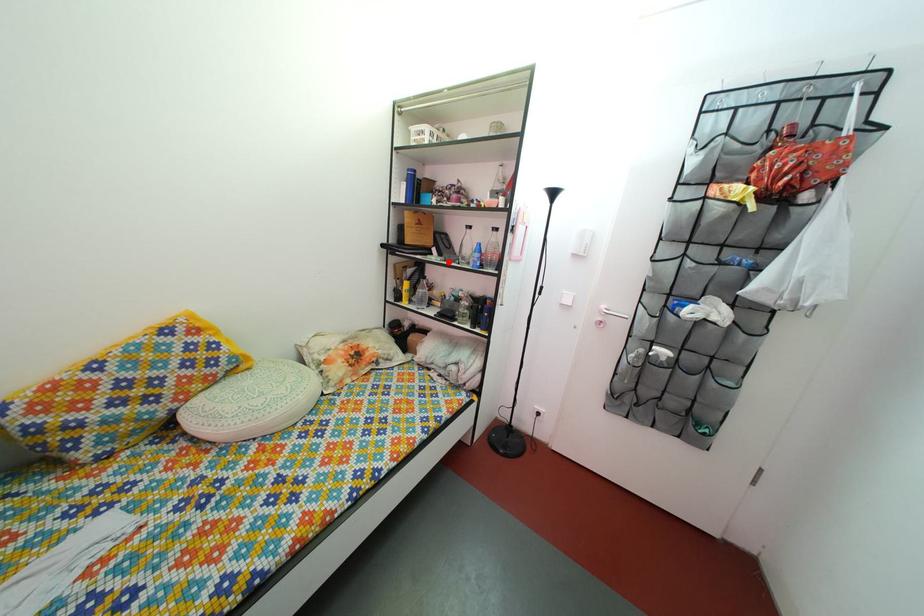
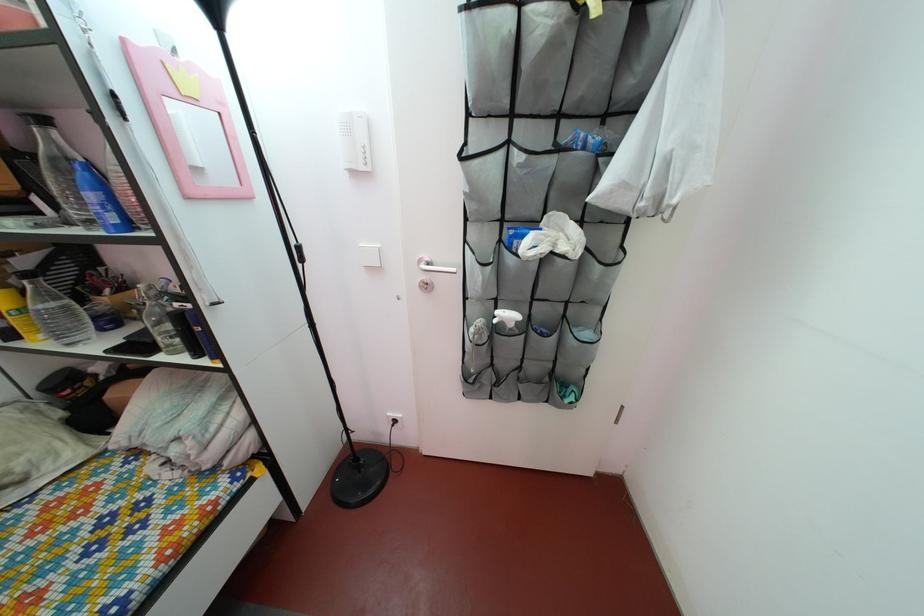
The point at the highlighted location is marked in the first image. Where is the corresponding point in the second image?

(68, 217)